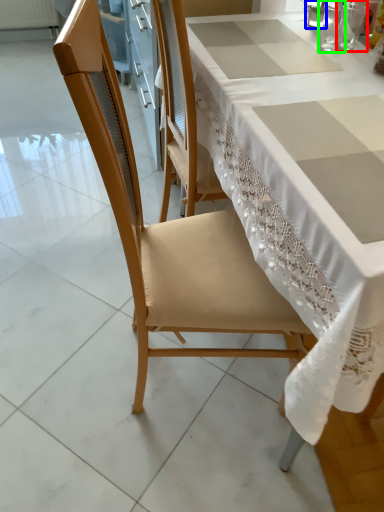
Question: Which object is positioned closest to tableware (highlighted by a red box)? Select from tableware (highlighted by a blue box) and tableware (highlighted by a green box).

Choices:
 (A) tableware
 (B) tableware

Answer: (B)